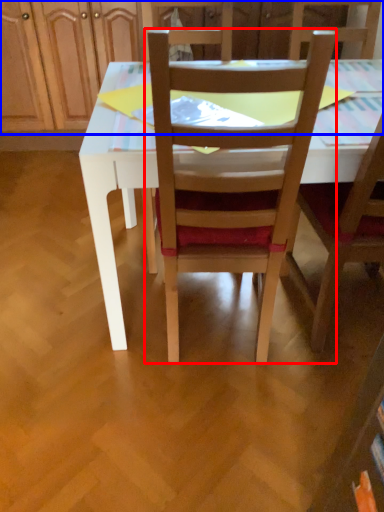
Question: Which object appears farthest to the camera in this image, chair (highlighted by a red box) or dresser (highlighted by a blue box)?

Choices:
 (A) chair
 (B) dresser

Answer: (B)